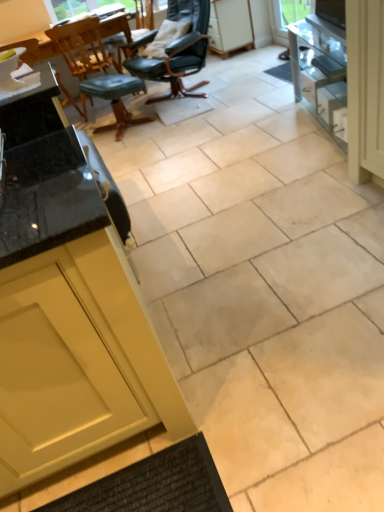
Question: Looking at the image, does white glossy drawer at right seem bigger or smaller compared to wooden chair at upper left, the second chair positioned from the left?

Choices:
 (A) small
 (B) big

Answer: (A)

Question: Do you think white glossy drawer at right is within wooden chair at upper left, the second chair positioned from the left, or outside of it?

Choices:
 (A) outside
 (B) inside

Answer: (A)

Question: Which is nearer to the leather-like black chair at upper center, positioned as the 1th chair in right-to-left order?

Choices:
 (A) wooden chair at upper left, which is counted as the 2th chair, starting from the right
 (B) white glossy drawer at right
 (C) green leather stool at center
 (D) white matte cabinet at upper center
 (E) matte black chair at left, which is counted as the first chair, starting from the left

Answer: (C)

Question: Based on their relative distances, which object is nearer to the white glossy drawer at right?

Choices:
 (A) leather-like black chair at upper center, the 3th chair positioned from the left
 (B) white matte cabinet at upper center
 (C) matte black chair at left, which is counted as the first chair, starting from the left
 (D) wooden chair at upper left, which is counted as the 2th chair, starting from the right
 (E) green leather stool at center

Answer: (A)